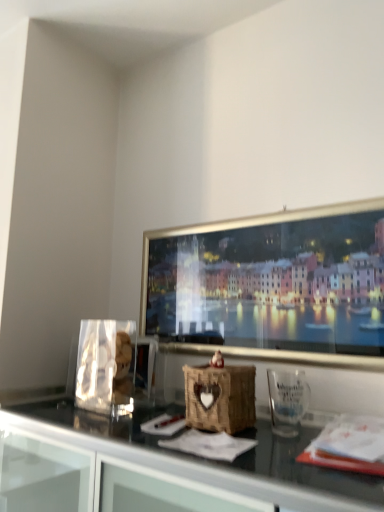
Question: Considering the relative sizes of woven wood basket at center and transparent plastic glass at lower right in the image provided, is woven wood basket at center thinner than transparent plastic glass at lower right?

Choices:
 (A) yes
 (B) no

Answer: (B)

Question: Is transparent plastic glass at lower right at the back of woven wood basket at center?

Choices:
 (A) no
 (B) yes

Answer: (A)

Question: Can you confirm if woven wood basket at center is shorter than transparent plastic glass at lower right?

Choices:
 (A) no
 (B) yes

Answer: (A)

Question: Is woven wood basket at center to the right of transparent plastic glass at lower right from the viewer's perspective?

Choices:
 (A) yes
 (B) no

Answer: (B)

Question: Is woven wood basket at center wider than transparent plastic glass at lower right?

Choices:
 (A) no
 (B) yes

Answer: (B)

Question: Would you say transparent plastic glass at lower right is part of woven wood basket at center's contents?

Choices:
 (A) no
 (B) yes

Answer: (A)

Question: Would you say transparent plastic glass at lower right contains woven wood basket at center?

Choices:
 (A) yes
 (B) no

Answer: (B)

Question: From a real-world perspective, is transparent plastic glass at lower right under woven wood basket at center?

Choices:
 (A) no
 (B) yes

Answer: (A)

Question: Is transparent plastic glass at lower right facing towards woven wood basket at center?

Choices:
 (A) yes
 (B) no

Answer: (B)

Question: Considering the relative sizes of transparent plastic glass at lower right and woven wood basket at center in the image provided, is transparent plastic glass at lower right taller than woven wood basket at center?

Choices:
 (A) no
 (B) yes

Answer: (A)

Question: Is transparent plastic glass at lower right completely or partially outside of woven wood basket at center?

Choices:
 (A) yes
 (B) no

Answer: (A)

Question: Can you confirm if transparent plastic glass at lower right is bigger than woven wood basket at center?

Choices:
 (A) yes
 (B) no

Answer: (B)

Question: Visually, is transparent plastic glass at lower right positioned to the left or to the right of woven wood basket at center?

Choices:
 (A) right
 (B) left

Answer: (A)